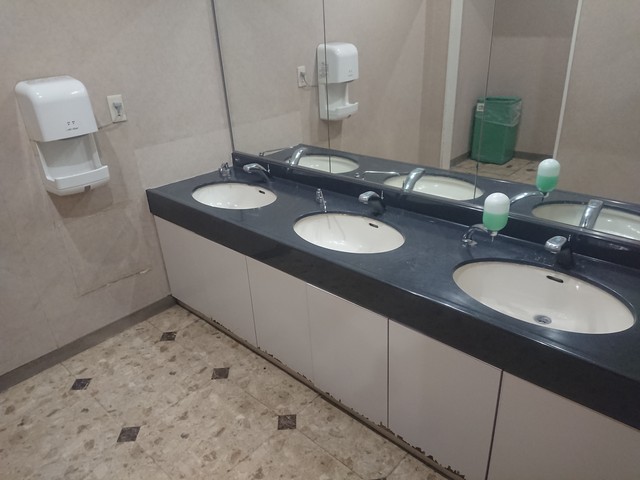
The image size is (640, 480). I want to click on hand soap, so click(493, 211).